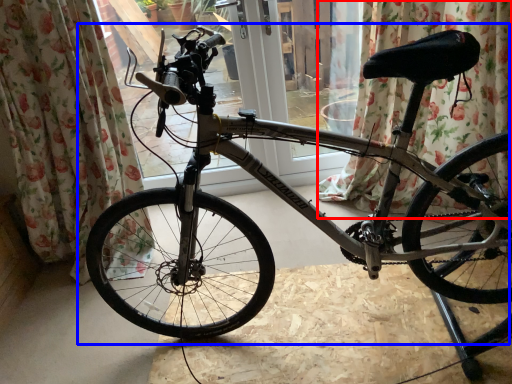
Question: Which object is closer to the camera taking this photo, curtain (highlighted by a red box) or bicycle (highlighted by a blue box)?

Choices:
 (A) curtain
 (B) bicycle

Answer: (B)